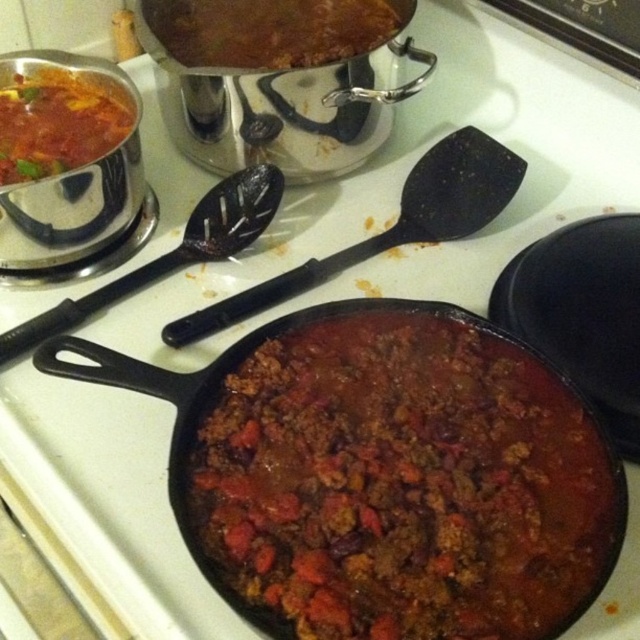
Question: Is the position of brown matte chili at center more distant than that of brown matte pot at upper center?

Choices:
 (A) no
 (B) yes

Answer: (A)

Question: Is black plastic spatula at center to the left of black plastic spoon at upper left from the viewer's perspective?

Choices:
 (A) yes
 (B) no

Answer: (B)

Question: Where is brown matte chili at center located in relation to brown matte pot at upper center in the image?

Choices:
 (A) above
 (B) below

Answer: (B)

Question: Which point is closer to the camera?

Choices:
 (A) black plastic spoon at upper left
 (B) brown matte pot at upper center

Answer: (A)

Question: Which object is the farthest from the black plastic spatula at center?

Choices:
 (A) black plastic spoon at upper left
 (B) brown matte pot at upper center

Answer: (B)

Question: Which point is farther to the camera?

Choices:
 (A) brown matte chili at center
 (B) matte black chili at upper left
 (C) black plastic spatula at center
 (D) black plastic spoon at upper left

Answer: (B)